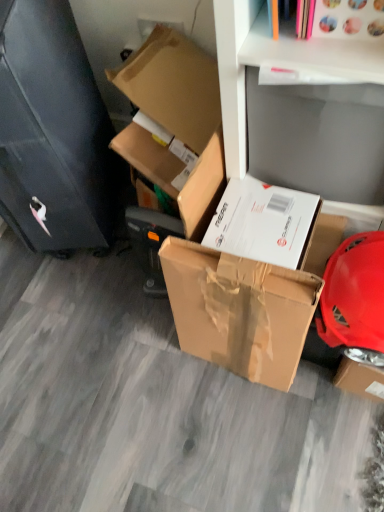
Question: Is white matte shelf at upper center at the back of brown cardboard box at upper left, which ranks as the 1th box in top-to-bottom order?

Choices:
 (A) no
 (B) yes

Answer: (A)

Question: Is brown cardboard box at upper left, positioned as the second box in bottom-to-top order, with white matte shelf at upper center?

Choices:
 (A) no
 (B) yes

Answer: (A)

Question: Does brown cardboard box at upper left, which ranks as the 1th box in top-to-bottom order, come behind white matte shelf at upper center?

Choices:
 (A) no
 (B) yes

Answer: (B)

Question: From a real-world perspective, is brown cardboard box at upper left, which ranks as the 1th box in top-to-bottom order, physically above white matte shelf at upper center?

Choices:
 (A) yes
 (B) no

Answer: (B)

Question: Is brown cardboard box at upper left, which ranks as the 1th box in top-to-bottom order, positioned before white matte shelf at upper center?

Choices:
 (A) no
 (B) yes

Answer: (A)

Question: Considering the positions of brown cardboard box at center, which is the 1th box in bottom-to-top order, and brown cardboard box at upper left, which ranks as the 1th box in top-to-bottom order, in the image, is brown cardboard box at center, which is the 1th box in bottom-to-top order, taller or shorter than brown cardboard box at upper left, which ranks as the 1th box in top-to-bottom order,?

Choices:
 (A) tall
 (B) short

Answer: (A)

Question: Considering their positions, is brown cardboard box at center, which is the 1th box in bottom-to-top order, located in front of or behind brown cardboard box at upper left, which ranks as the 1th box in top-to-bottom order?

Choices:
 (A) behind
 (B) front

Answer: (B)

Question: Considering the positions of point (279, 369) and point (196, 84), is point (279, 369) closer or farther from the camera than point (196, 84)?

Choices:
 (A) closer
 (B) farther

Answer: (A)

Question: Is brown cardboard box at center, which is the 1th box in bottom-to-top order, inside or outside of brown cardboard box at upper left, which ranks as the 1th box in top-to-bottom order?

Choices:
 (A) inside
 (B) outside

Answer: (B)

Question: Considering the positions of white matte shelf at upper center and brown cardboard box at upper left, positioned as the second box in bottom-to-top order, in the image, is white matte shelf at upper center wider or thinner than brown cardboard box at upper left, positioned as the second box in bottom-to-top order,?

Choices:
 (A) wide
 (B) thin

Answer: (B)

Question: In terms of height, does white matte shelf at upper center look taller or shorter compared to brown cardboard box at upper left, which ranks as the 1th box in top-to-bottom order?

Choices:
 (A) short
 (B) tall

Answer: (A)

Question: Does point (233, 48) appear closer or farther from the camera than point (180, 73)?

Choices:
 (A) closer
 (B) farther

Answer: (A)

Question: Would you say white matte shelf at upper center is inside or outside brown cardboard box at upper left, positioned as the second box in bottom-to-top order?

Choices:
 (A) outside
 (B) inside

Answer: (A)

Question: From the image's perspective, is white matte shelf at upper center above or below black matte file cabinet at left?

Choices:
 (A) above
 (B) below

Answer: (B)

Question: Based on their positions, is white matte shelf at upper center located to the left or right of black matte file cabinet at left?

Choices:
 (A) right
 (B) left

Answer: (A)